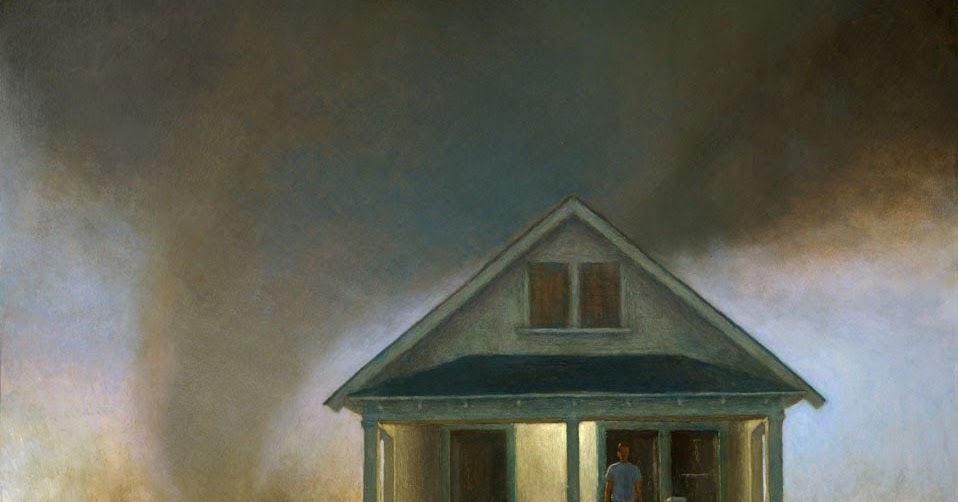
You are a GUI agent. You are given a task and a screenshot of the screen. Output one action in this format:
    pyautogui.click(x=<x>, y=<y>)
    Task: Click on the door
    
    Given the screenshot: What is the action you would take?
    pyautogui.click(x=687, y=452)